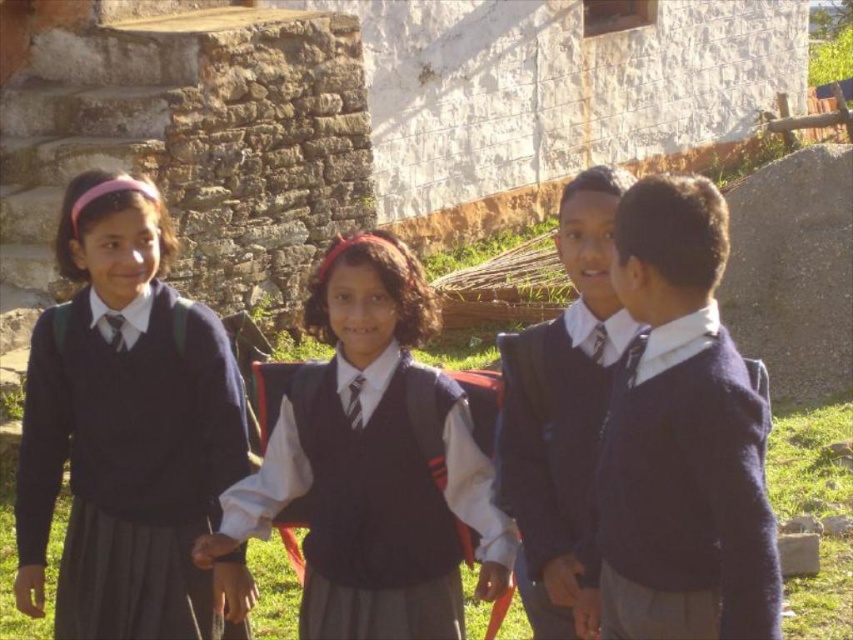
Question: Which point appears farthest from the camera in this image?

Choices:
 (A) (366, 413)
 (B) (601, 400)
 (C) (627, 460)

Answer: (A)

Question: Which point is farther to the camera?

Choices:
 (A) [166, 333]
 (B) [495, 541]
 (C) [577, 250]
 (D) [718, 611]

Answer: (A)

Question: Observing the image, what is the correct spatial positioning of matte black sweater at left in reference to matte black vest at center?

Choices:
 (A) above
 (B) below

Answer: (A)

Question: Is matte black sweater at left smaller than matte blue sweater at right?

Choices:
 (A) yes
 (B) no

Answer: (A)

Question: Is matte black sweater at left wider than matte blue sweater at right?

Choices:
 (A) no
 (B) yes

Answer: (A)

Question: Among these objects, which one is nearest to the camera?

Choices:
 (A) matte black sweater at left
 (B) matte blue sweater at right
 (C) matte black sweater at center

Answer: (B)